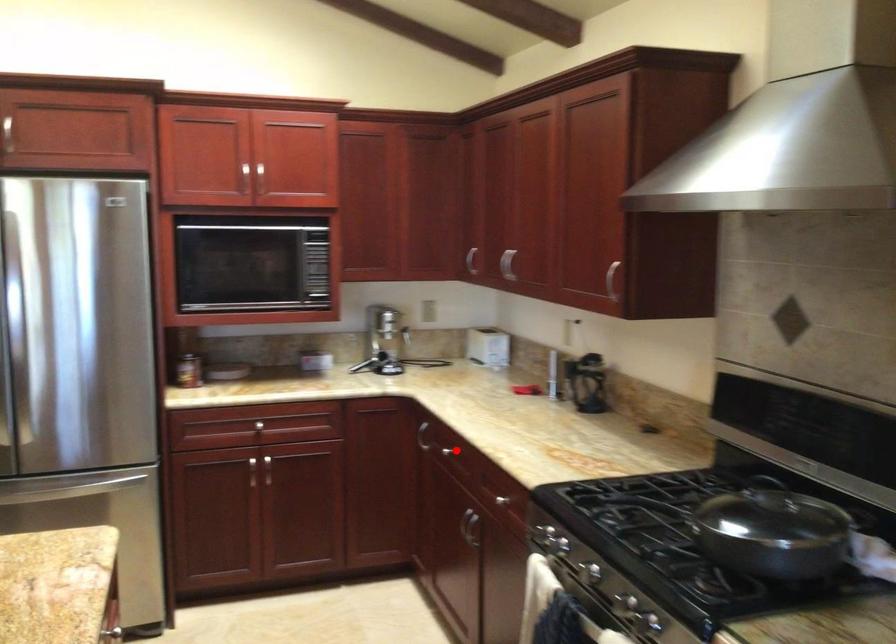
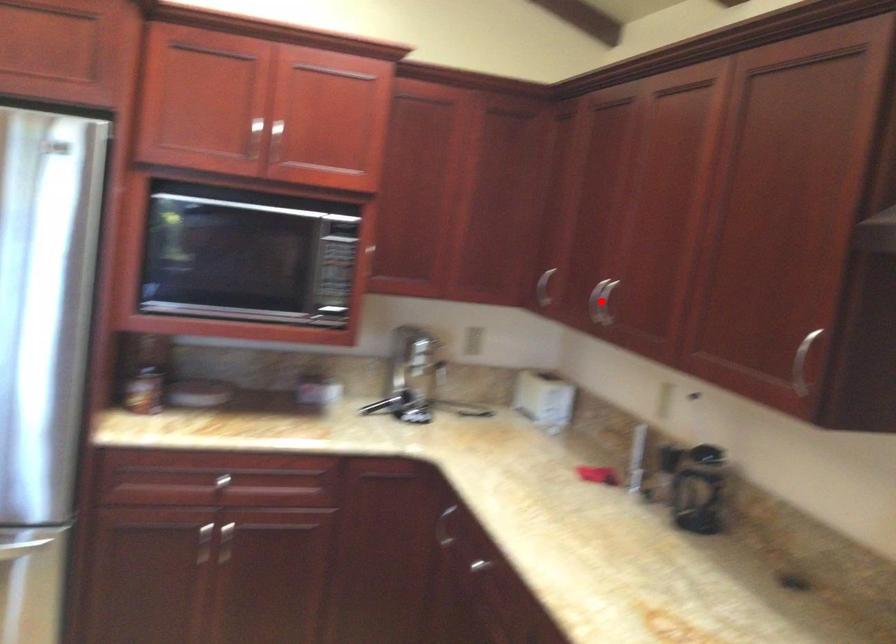
I am providing you with two images of the same scene from different viewpoints. A red point is marked on the first image and another point is marked on the second image. Do the highlighted points in image1 and image2 indicate the same real-world spot?

No